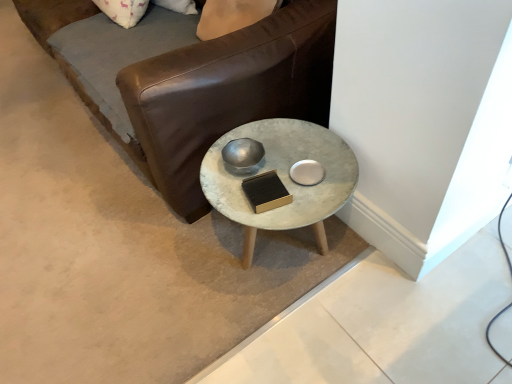
This screenshot has width=512, height=384. I want to click on metallic stone coffee table at center, so click(x=283, y=176).

The width and height of the screenshot is (512, 384). What do you see at coordinates (283, 176) in the screenshot?
I see `metallic stone coffee table at center` at bounding box center [283, 176].

I want to click on metallic stone coffee table at center, so point(283,176).